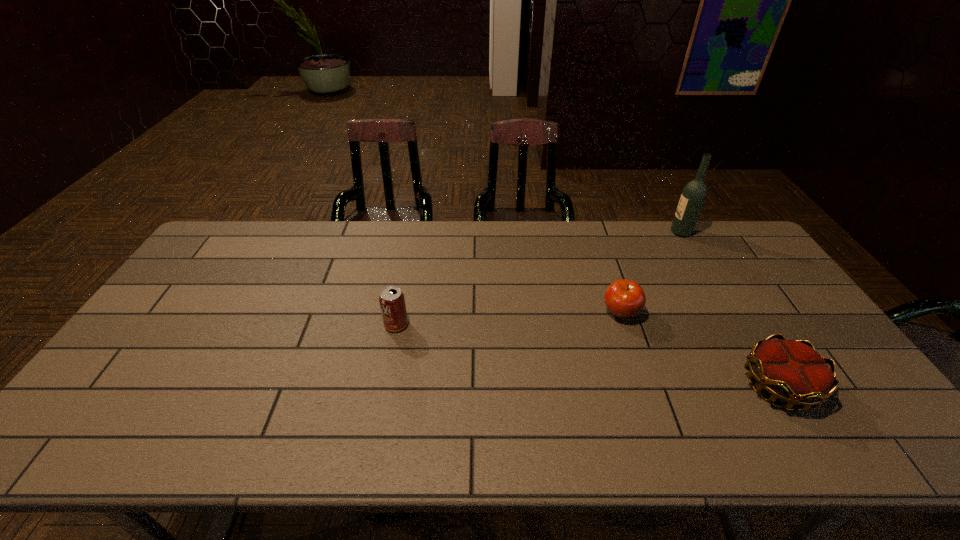
The width and height of the screenshot is (960, 540). In order to click on free spot that satisfies the following two spatial constraints: 1. on the labeled side of the tallest object; 2. on the back side of the nearest object in this screenshot , I will do `click(771, 386)`.

Identify the location of free space that satisfies the following two spatial constraints: 1. on the labeled side of the wine bottle; 2. on the front side of the apple. This screenshot has height=540, width=960. (729, 313).

Identify the location of vacant position in the image that satisfies the following two spatial constraints: 1. on the labeled side of the wine bottle; 2. on the front side of the soda can. (735, 325).

At what (x,y) coordinates should I click in order to perform the action: click on blank area in the image that satisfies the following two spatial constraints: 1. on the labeled side of the crown; 2. on the right side of the tallest object. Please return your answer as a coordinate pair (x, y). Looking at the image, I should click on (771, 386).